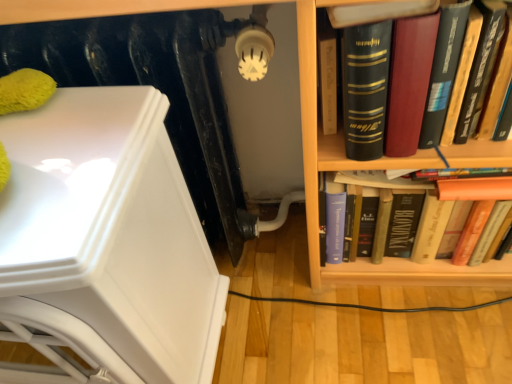
Question: From the image's perspective, would you say white glossy armchair at left is shown under black matte radiator at upper left?

Choices:
 (A) no
 (B) yes

Answer: (B)

Question: Is black matte radiator at upper left at the back of white glossy armchair at left?

Choices:
 (A) no
 (B) yes

Answer: (B)

Question: Considering the relative sizes of white glossy armchair at left and black matte radiator at upper left in the image provided, is white glossy armchair at left thinner than black matte radiator at upper left?

Choices:
 (A) no
 (B) yes

Answer: (A)

Question: From a real-world perspective, is white glossy armchair at left positioned over black matte radiator at upper left based on gravity?

Choices:
 (A) no
 (B) yes

Answer: (A)

Question: From a real-world perspective, is white glossy armchair at left physically below black matte radiator at upper left?

Choices:
 (A) yes
 (B) no

Answer: (A)

Question: Would you say white glossy armchair at left contains black matte radiator at upper left?

Choices:
 (A) yes
 (B) no

Answer: (B)

Question: From the image's perspective, is wooden bookshelf at right below white glossy armchair at left?

Choices:
 (A) no
 (B) yes

Answer: (A)

Question: Is wooden bookshelf at right turned away from white glossy armchair at left?

Choices:
 (A) no
 (B) yes

Answer: (A)

Question: Considering the relative sizes of wooden bookshelf at right and white glossy armchair at left in the image provided, is wooden bookshelf at right thinner than white glossy armchair at left?

Choices:
 (A) no
 (B) yes

Answer: (A)

Question: From a real-world perspective, is wooden bookshelf at right physically above white glossy armchair at left?

Choices:
 (A) yes
 (B) no

Answer: (A)

Question: Is wooden bookshelf at right surrounding white glossy armchair at left?

Choices:
 (A) no
 (B) yes

Answer: (A)

Question: Would you say wooden bookshelf at right is outside white glossy armchair at left?

Choices:
 (A) yes
 (B) no

Answer: (A)

Question: Is hardcover book at right touching wooden bookshelf at right?

Choices:
 (A) no
 (B) yes

Answer: (A)